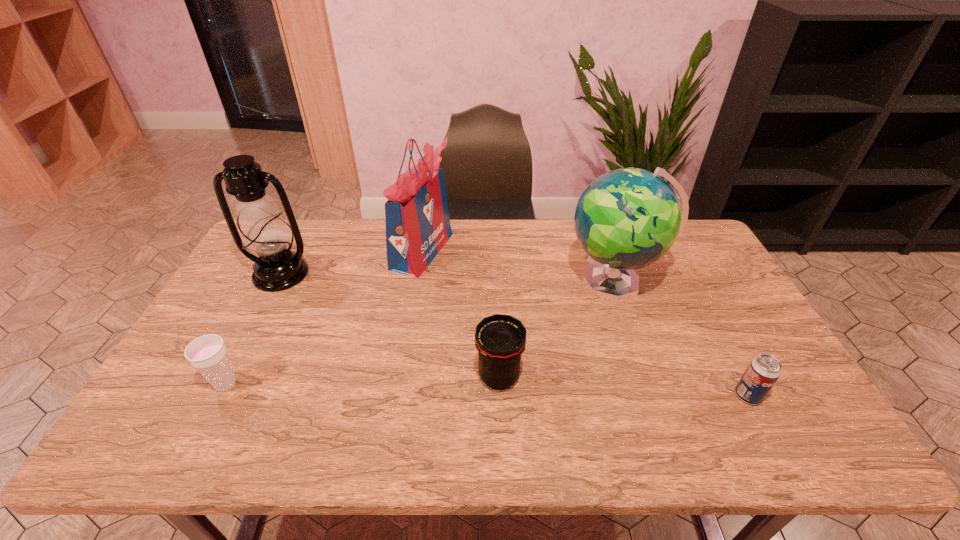
Find the location of a particular element. object at the far left corner is located at coordinates (264, 232).

Where is `vacant space at the far edge of the desktop`? Image resolution: width=960 pixels, height=540 pixels. vacant space at the far edge of the desktop is located at coordinates (356, 241).

This screenshot has height=540, width=960. I want to click on vacant space at the near edge, so click(x=222, y=447).

This screenshot has width=960, height=540. In order to click on free space at the left edge of the desktop in this screenshot , I will do `click(245, 260)`.

I want to click on vacant area at the right edge, so click(x=759, y=412).

In the image, there is a desktop. Where is `vacant area at the near left corner`? The width and height of the screenshot is (960, 540). vacant area at the near left corner is located at coordinates (164, 433).

You are a GUI agent. You are given a task and a screenshot of the screen. Output one action in this format:
    pyautogui.click(x=<x>, y=<y>)
    Task: Click on the vacant space at the near right corner
    The image size is (960, 540).
    Given the screenshot: What is the action you would take?
    pyautogui.click(x=814, y=436)

Image resolution: width=960 pixels, height=540 pixels. What are the coordinates of `free space that is in between the globe and the telephoto lens` in the screenshot? It's located at (557, 329).

Locate an element on the screen. free area in between the fourth object from right to left and the second object from right to left is located at coordinates (518, 267).

I want to click on unoccupied area between the telephoto lens and the grocery bag, so click(x=461, y=314).